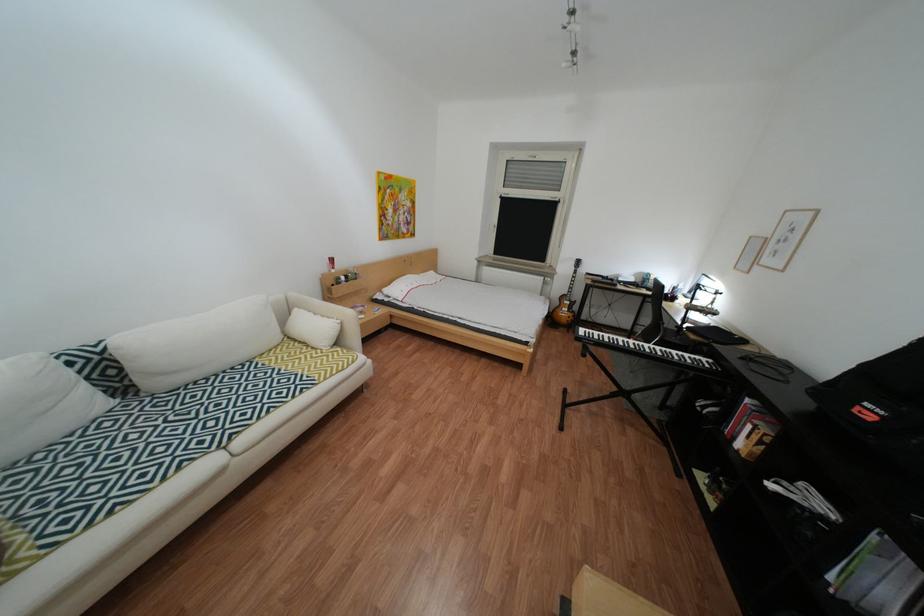
This screenshot has width=924, height=616. I want to click on white plastic bottle, so tap(331, 262).